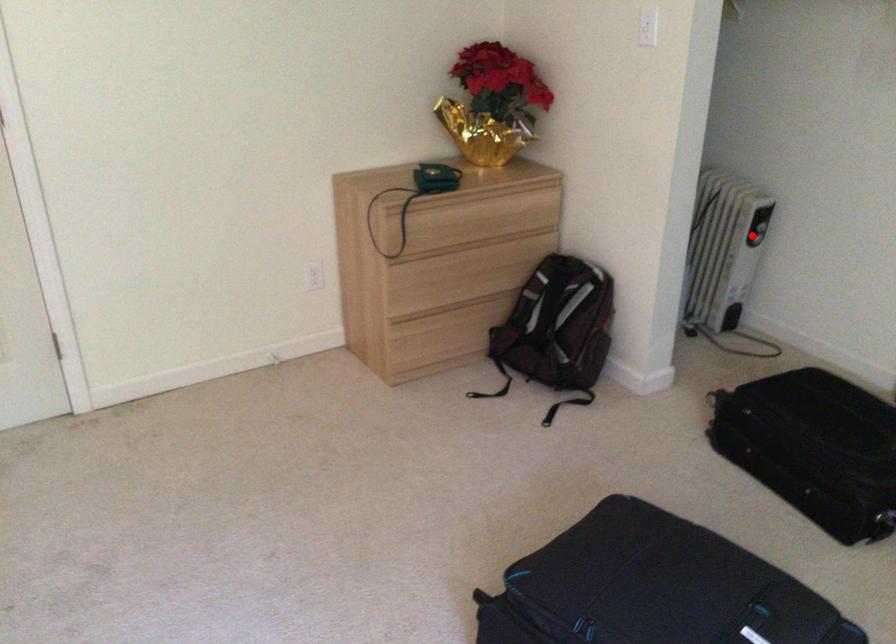
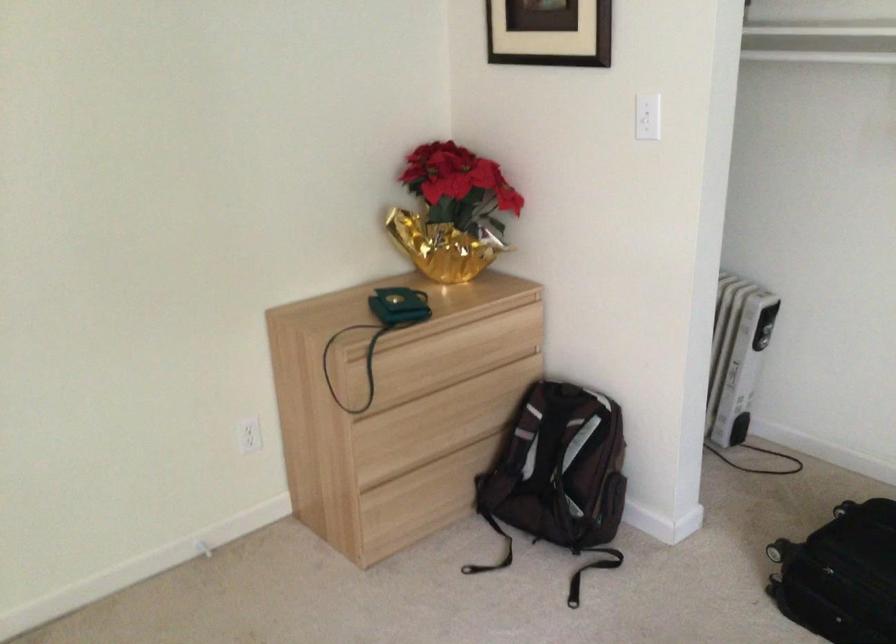
Question: A red point is marked in image1. In image2, is the corresponding 3D point closer to the camera or farther? Reply with the corresponding letter.

Choices:
 (A) The corresponding 3D point is closer.
 (B) The corresponding 3D point is farther.

Answer: (A)